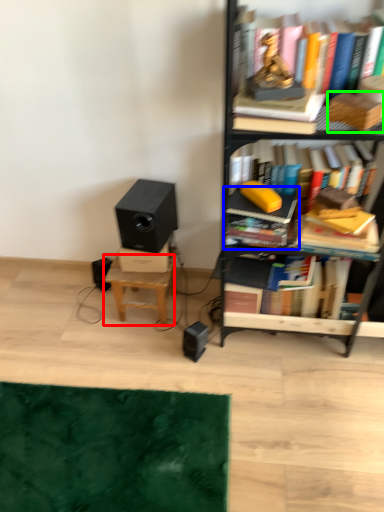
Question: Which object is the farthest from stool (highlighted by a red box)? Choose among these: book (highlighted by a blue box) or paperback book (highlighted by a green box).

Choices:
 (A) book
 (B) paperback book

Answer: (B)